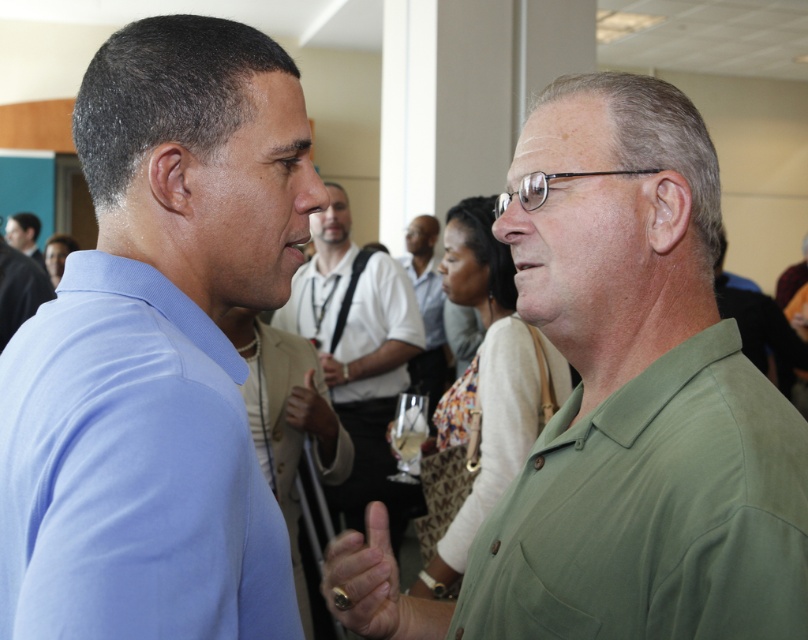
You are standing at the point marked as point (343, 196) in the image. You want to greet the man on the left wearing a light blue collared shirt. Can you reach him without moving from your current position?

The point marked as point (343, 196) is 3.98 meters away from the viewer, so yes, you can reach the man on the left wearing a light blue collared shirt without moving from your current position since the distance is manageable for a greeting.

You are a photographer standing at a networking event and want to take a closeup photo of the green matte shirt at right. The camera you are using has a minimum focusing distance of 30 inches. Can you successfully take the photo without moving closer?

The green matte shirt at right and viewer are 29.56 inches apart from each other, which is less than the camera minimum focusing distance of 30 inches. Therefore, you cannot take the photo without moving closer.